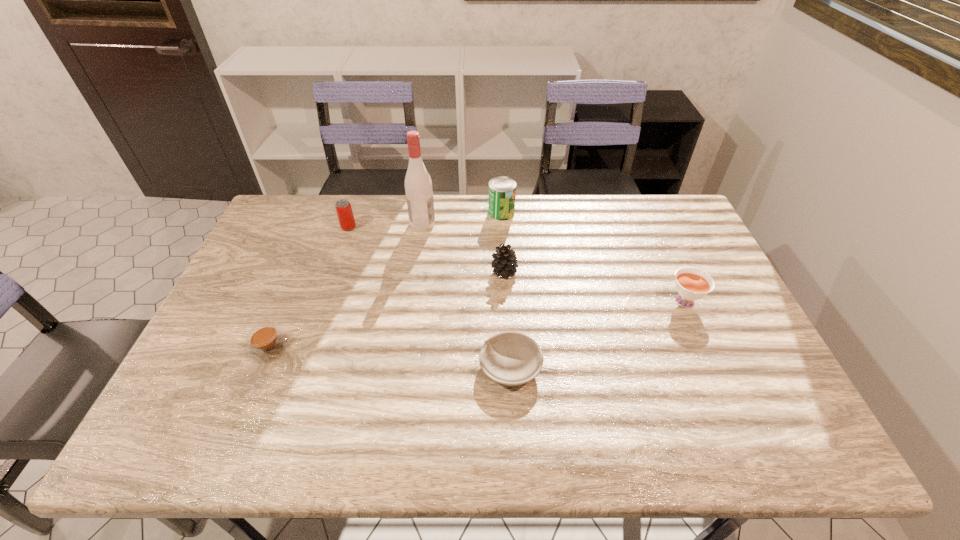
Where is `alcohol`? The width and height of the screenshot is (960, 540). alcohol is located at coordinates (418, 186).

I want to click on the fifth object from right to left, so click(418, 186).

What are the coordinates of `can` in the screenshot? It's located at (502, 190).

Identify the location of pinecone. The width and height of the screenshot is (960, 540). 504,262.

Where is `the second object from left to right`? the second object from left to right is located at coordinates (343, 207).

The width and height of the screenshot is (960, 540). In order to click on the third nearest object in this screenshot , I will do `click(691, 285)`.

Locate an element on the screen. The image size is (960, 540). the third shortest object is located at coordinates (691, 285).

This screenshot has width=960, height=540. I want to click on cappuccino, so click(266, 343).

The width and height of the screenshot is (960, 540). Find the location of `the leftmost object`. the leftmost object is located at coordinates (266, 343).

You are a GUI agent. You are given a task and a screenshot of the screen. Output one action in this format:
    pyautogui.click(x=<x>, y=<y>)
    Task: Click on the shortest object
    
    Given the screenshot: What is the action you would take?
    pyautogui.click(x=509, y=358)